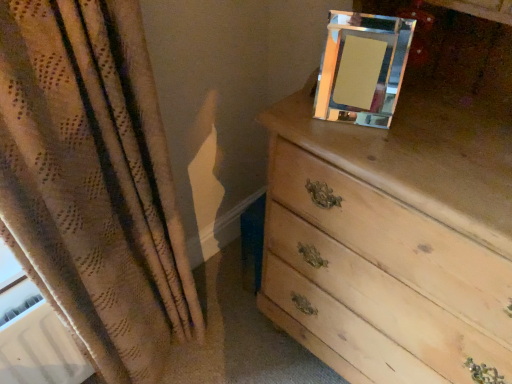
Question: In the image, is light wood chest of drawers at upper right on the left side or the right side of clear glass picture frame at upper right?

Choices:
 (A) right
 (B) left

Answer: (A)

Question: Considering the positions of light wood chest of drawers at upper right and clear glass picture frame at upper right in the image, is light wood chest of drawers at upper right wider or thinner than clear glass picture frame at upper right?

Choices:
 (A) thin
 (B) wide

Answer: (B)

Question: Considering the positions of light wood chest of drawers at upper right and clear glass picture frame at upper right in the image, is light wood chest of drawers at upper right taller or shorter than clear glass picture frame at upper right?

Choices:
 (A) short
 (B) tall

Answer: (B)

Question: Based on their positions, is clear glass picture frame at upper right located to the left or right of light wood chest of drawers at upper right?

Choices:
 (A) right
 (B) left

Answer: (B)

Question: In terms of size, does clear glass picture frame at upper right appear bigger or smaller than light wood chest of drawers at upper right?

Choices:
 (A) big
 (B) small

Answer: (B)

Question: Which is correct: clear glass picture frame at upper right is inside light wood chest of drawers at upper right, or outside of it?

Choices:
 (A) outside
 (B) inside

Answer: (B)

Question: Considering the positions of clear glass picture frame at upper right and light wood chest of drawers at upper right in the image, is clear glass picture frame at upper right taller or shorter than light wood chest of drawers at upper right?

Choices:
 (A) tall
 (B) short

Answer: (B)